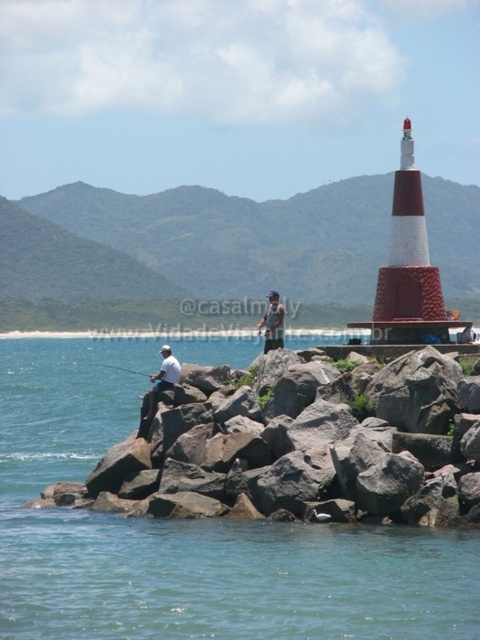
Does transparent blue water at center appear under white matte shirt at left?

Correct, transparent blue water at center is located below white matte shirt at left.

Between point (168, 545) and point (157, 394), which one is positioned behind?

Point (157, 394)

Identify the location of transparent blue water at center. The height and width of the screenshot is (640, 480). (188, 536).

Does point (12, 416) lie in front of point (273, 312)?

That is False.

Is transparent blue water at center smaller than white fabric shirt at center?

Actually, transparent blue water at center might be larger than white fabric shirt at center.

This screenshot has width=480, height=640. I want to click on transparent blue water at center, so click(188, 536).

Does white matte shirt at left have a lesser height compared to white fabric shirt at center?

In fact, white matte shirt at left may be taller than white fabric shirt at center.

Does white matte shirt at left appear on the right side of white fabric shirt at center?

No, white matte shirt at left is not to the right of white fabric shirt at center.

Locate an element on the screen. This screenshot has height=640, width=480. white matte shirt at left is located at coordinates (158, 387).

Find the location of `white matte shirt at left`. white matte shirt at left is located at coordinates (158, 387).